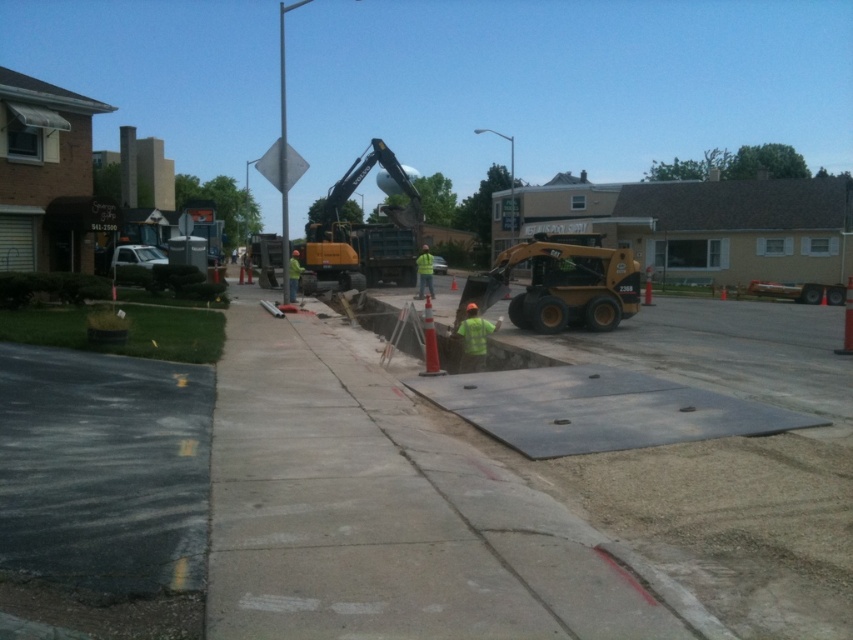
Between yellow rubber skid steer loader at center and green reflective vest at center, which one appears on the left side from the viewer's perspective?

From the viewer's perspective, green reflective vest at center appears more on the left side.

Is point (532, 280) closer to viewer compared to point (299, 273)?

Yes, point (532, 280) is in front of point (299, 273).

I want to click on yellow rubber skid steer loader at center, so click(x=560, y=284).

Between gray concrete pavement at center and green reflective vest at center, which one is positioned lower?

Positioned lower is gray concrete pavement at center.

Can you confirm if gray concrete pavement at center is bigger than green reflective vest at center?

Indeed, gray concrete pavement at center has a larger size compared to green reflective vest at center.

At what (x,y) coordinates should I click in order to perform the action: click on gray concrete pavement at center. Please return your answer as a coordinate pair (x, y). Looking at the image, I should click on (393, 515).

Which of these two, yellow rubber excavator at center or yellow reflective vest at center, stands taller?

yellow rubber excavator at center is taller.

Is yellow rubber excavator at center to the right of yellow reflective vest at center from the viewer's perspective?

In fact, yellow rubber excavator at center is to the left of yellow reflective vest at center.

Between point (392, 161) and point (416, 280), which one is positioned behind?

Positioned behind is point (416, 280).

The image size is (853, 640). Identify the location of yellow rubber excavator at center. (363, 228).